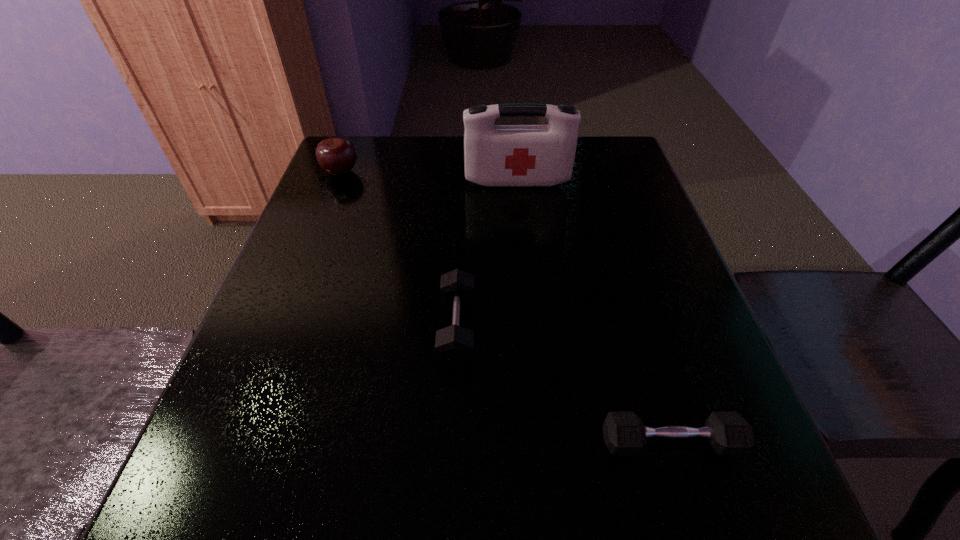
Locate an element on the screen. The width and height of the screenshot is (960, 540). vacant space located 0.310m on the back of the nearest object is located at coordinates (620, 278).

Where is `the first-aid kit located in the far edge section of the desktop`? Image resolution: width=960 pixels, height=540 pixels. the first-aid kit located in the far edge section of the desktop is located at coordinates (494, 155).

Find the location of `apple situated at the far edge`. apple situated at the far edge is located at coordinates (337, 156).

Find the location of a particular element. This screenshot has width=960, height=540. object present at the left edge is located at coordinates (337, 156).

Locate an element on the screen. This screenshot has height=540, width=960. object present at the right edge is located at coordinates (624, 433).

In order to click on object present at the far left corner in this screenshot , I will do `click(337, 156)`.

Find the location of `free space at the far edge of the desktop`. free space at the far edge of the desktop is located at coordinates (463, 175).

Locate an element on the screen. The height and width of the screenshot is (540, 960). vacant area at the near edge of the desktop is located at coordinates (391, 483).

Where is `vacant space at the left edge`? The width and height of the screenshot is (960, 540). vacant space at the left edge is located at coordinates coord(217,455).

Locate an element on the screen. blank space at the right edge of the desktop is located at coordinates (684, 458).